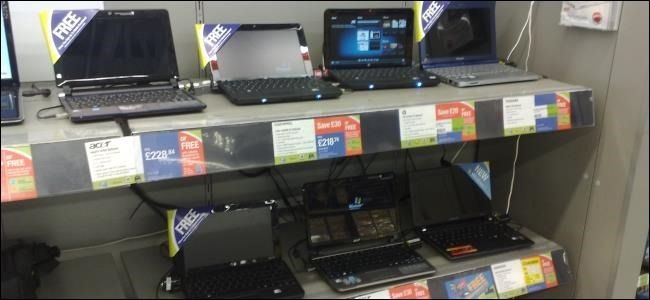
The image size is (650, 300). Identify the location of keyboards. (129, 99), (268, 88), (370, 72), (486, 69), (458, 231), (384, 253), (273, 278).